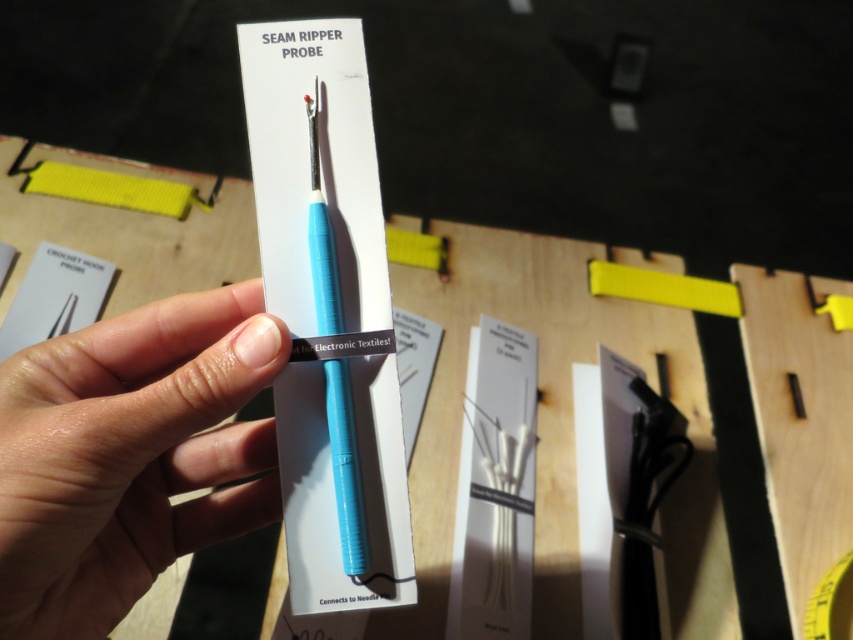
Question: In this image, where is light skin tone flesh at center located relative to yellow matte tape measure at center?

Choices:
 (A) left
 (B) right

Answer: (A)

Question: Estimate the real-world distances between objects in this image. Which object is closer to the yellow matte tape measure at center?

Choices:
 (A) light skin tone flesh at center
 (B) blue plastic seam ripper probe at center

Answer: (B)

Question: Which of the following is the farthest from the observer?

Choices:
 (A) (811, 632)
 (B) (346, 429)

Answer: (A)

Question: Observing the image, what is the correct spatial positioning of light skin tone flesh at center in reference to blue plastic seam ripper probe at center?

Choices:
 (A) right
 (B) left

Answer: (B)

Question: Which of the following is the farthest from the observer?

Choices:
 (A) (833, 589)
 (B) (199, 540)
 (C) (318, 296)

Answer: (A)

Question: Is light skin tone flesh at center wider than blue plastic seam ripper probe at center?

Choices:
 (A) yes
 (B) no

Answer: (A)